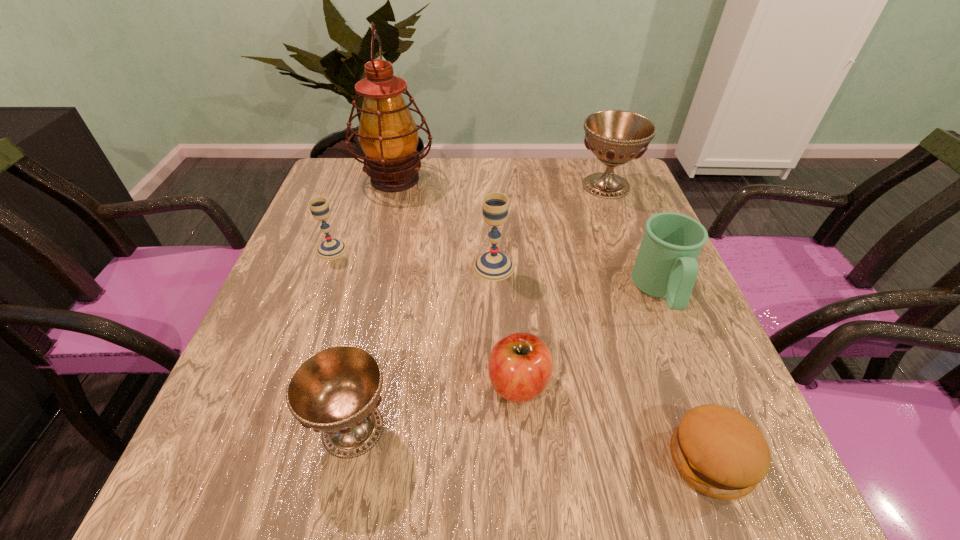
Locate an element on the screen. The height and width of the screenshot is (540, 960). apple is located at coordinates point(520,366).

At what (x,y) coordinates should I click in order to perform the action: click on the shortest object. Please return your answer as a coordinate pair (x, y). This screenshot has height=540, width=960. Looking at the image, I should click on (717, 450).

This screenshot has height=540, width=960. In order to click on brown hamburger in this screenshot , I will do `click(717, 450)`.

Where is `free space located on the right of the tallest object`? This screenshot has width=960, height=540. free space located on the right of the tallest object is located at coordinates (467, 179).

Locate an element on the screen. The width and height of the screenshot is (960, 540). free space located on the left of the rightmost chalice is located at coordinates [x=489, y=186].

The height and width of the screenshot is (540, 960). I want to click on free space located on the left of the second chalice from right to left, so click(x=393, y=267).

Locate an element on the screen. Image resolution: width=960 pixels, height=540 pixels. free space located on the side of the mug with the handle is located at coordinates (691, 363).

You are a GUI agent. You are given a task and a screenshot of the screen. Output one action in this format:
    pyautogui.click(x=<x>, y=<y>)
    Task: Click on the free space located on the right of the smaller gray chalice
    
    Given the screenshot: What is the action you would take?
    pyautogui.click(x=492, y=250)

Identify the location of free space located 0.120m on the right of the second chalice from left to right. This screenshot has width=960, height=540. (468, 429).

Locate an element on the screen. free space located 0.240m on the left of the seventh tallest object is located at coordinates (351, 384).